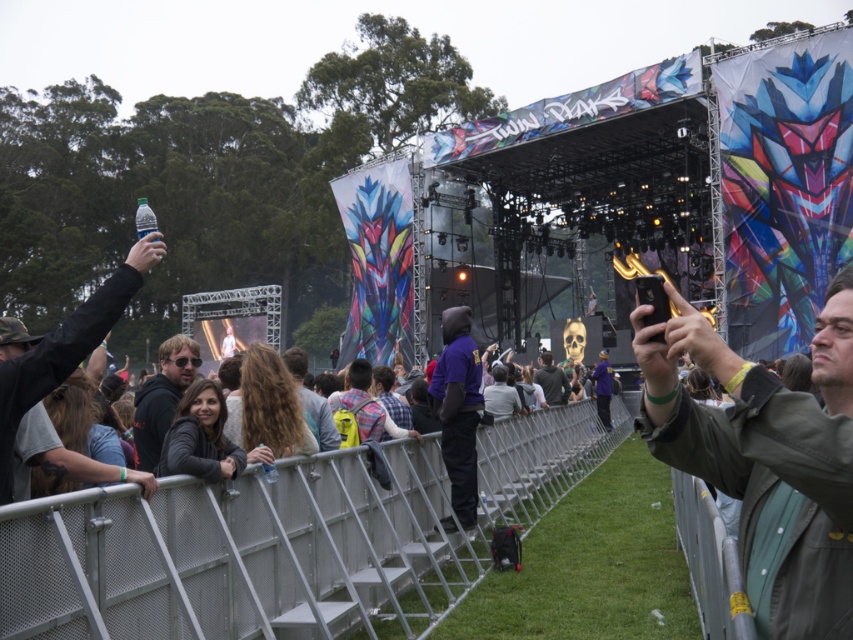
Is point (819, 371) positioned behind point (100, 348)?

No.

This screenshot has height=640, width=853. What do you see at coordinates (767, 460) in the screenshot?
I see `green fabric jacket at center` at bounding box center [767, 460].

Image resolution: width=853 pixels, height=640 pixels. In order to click on green fabric jacket at center in this screenshot , I will do `click(767, 460)`.

Which is above, matte black jacket at center or dark gray hoodie at center?

matte black jacket at center is above.

Who is lower down, matte black jacket at center or dark gray hoodie at center?

Positioned lower is dark gray hoodie at center.

Describe the element at coordinates (161, 397) in the screenshot. I see `matte black jacket at center` at that location.

The image size is (853, 640). Identify the location of matte black jacket at center. (161, 397).

Is green fabric jacket at center smaller than matte black jacket at center?

Incorrect, green fabric jacket at center is not smaller in size than matte black jacket at center.

Who is more distant from viewer, (840, 528) or (155, 397)?

The point (155, 397) is more distant.

Between point (753, 557) and point (160, 401), which one is positioned behind?

Positioned behind is point (160, 401).

Find the location of a particular element. The image size is (853, 640). green fabric jacket at center is located at coordinates (767, 460).